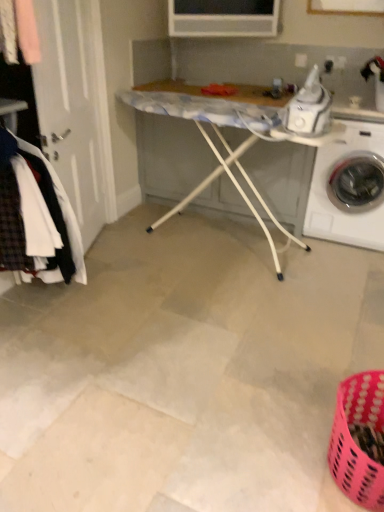
Question: Is point (59, 246) closer or farther from the camera than point (220, 123)?

Choices:
 (A) farther
 (B) closer

Answer: (B)

Question: In the image, is plaid wool coat at left on the left side or the right side of white plastic ironing board at center?

Choices:
 (A) right
 (B) left

Answer: (B)

Question: Which of these objects is positioned farthest from the white plastic ironing board at center?

Choices:
 (A) white glossy washing machine at right
 (B) plaid wool coat at left
 (C) white tile floor at center

Answer: (B)

Question: Which object is positioned farthest from the white glossy washing machine at right?

Choices:
 (A) plaid wool coat at left
 (B) white plastic ironing board at center
 (C) white tile floor at center

Answer: (A)